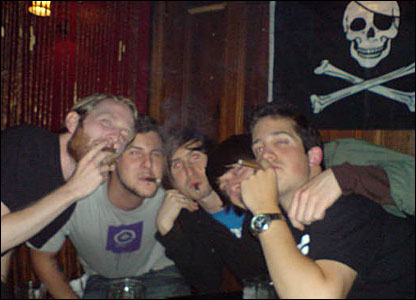
In order to click on hanging red beads in this screenshot , I will do `click(64, 74)`.